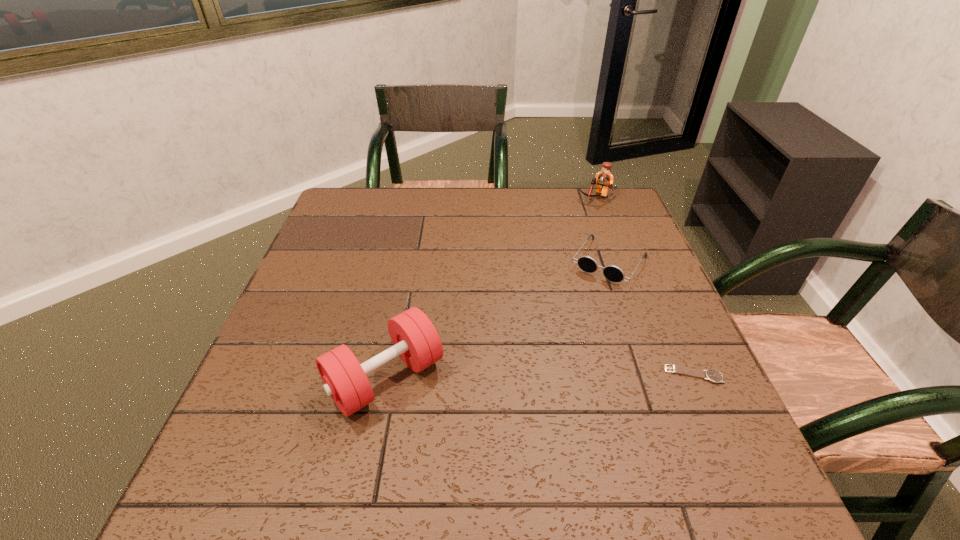
The height and width of the screenshot is (540, 960). I want to click on vacant point located between the third tallest object and the leftmost object, so click(497, 320).

The image size is (960, 540). Identify the location of vacant area that lies between the dumbbell and the shortest object. (540, 376).

Image resolution: width=960 pixels, height=540 pixels. I want to click on unoccupied area between the dumbbell and the Lego, so click(492, 288).

The width and height of the screenshot is (960, 540). I want to click on free spot between the watch and the leftmost object, so click(x=540, y=376).

The width and height of the screenshot is (960, 540). I want to click on empty space that is in between the dumbbell and the farthest object, so click(492, 288).

I want to click on empty space that is in between the sunglasses and the dumbbell, so pyautogui.click(x=497, y=320).

At what (x,y) coordinates should I click in order to perform the action: click on unoccupied area between the third nearest object and the shortest object. Please return your answer as a coordinate pair (x, y). Looking at the image, I should click on pos(652,318).

Locate an element on the screen. Image resolution: width=960 pixels, height=540 pixels. object that is the third closest to the sunglasses is located at coordinates (415, 339).

Identify which object is the nearest to the third tallest object. Please provide its 2D coordinates. Your answer should be formatted as a tuple, i.e. [(x, y)], where the tuple contains the x and y coordinates of a point satisfying the conditions above.

[(604, 179)]

The image size is (960, 540). Identify the location of vacant space that satisfies the following two spatial constraints: 1. on the back side of the second shortest object; 2. on the left side of the farthest object. (587, 198).